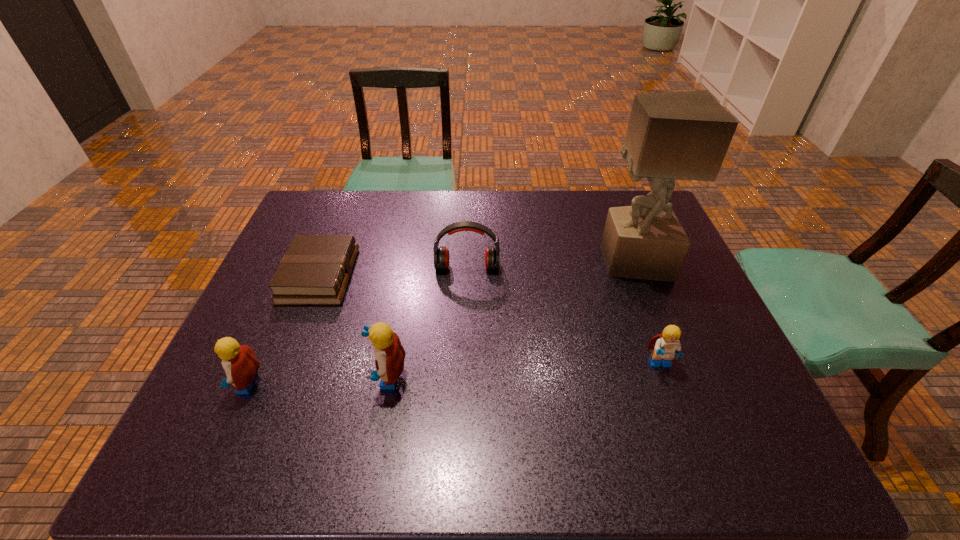
The image size is (960, 540). Identify the location of free spot between the second Lego from right to left and the sculpture. (510, 319).

Identify the location of empty location between the Bible and the sculpture. The image size is (960, 540). (476, 268).

What are the coordinates of `free space between the shortest Lego and the leftmost Lego` in the screenshot? It's located at (453, 374).

Where is `free spot between the second Lego from right to left and the third object from right to left`? free spot between the second Lego from right to left and the third object from right to left is located at coordinates pos(427,322).

I want to click on free space between the fourth object from left to right and the tallest object, so click(550, 264).

The image size is (960, 540). I want to click on free area in between the earphone and the rightmost Lego, so click(x=564, y=316).

Locate which object is the second closest to the second Lego from left to right. Please provide its 2D coordinates. Your answer should be formatted as a tuple, i.e. [(x, y)], where the tuple contains the x and y coordinates of a point satisfying the conditions above.

[(240, 364)]

Locate which object ranks fifth in proximity to the shortest object. Please provide its 2D coordinates. Your answer should be formatted as a tuple, i.e. [(x, y)], where the tuple contains the x and y coordinates of a point satisfying the conditions above.

[(666, 345)]

Find the location of a particular element. Lego that can be found as the closest to the rightmost Lego is located at coordinates (389, 354).

Where is `Lego that is the third closest to the shortest object`? This screenshot has height=540, width=960. Lego that is the third closest to the shortest object is located at coordinates (666, 345).